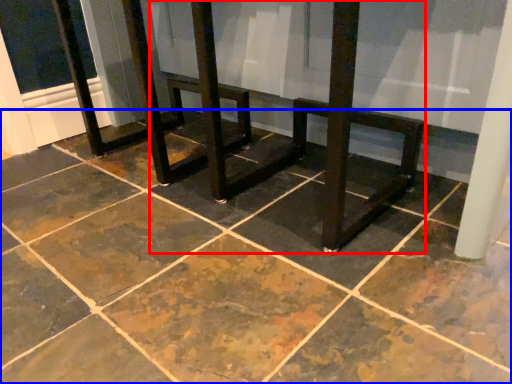
Question: Which of the following is the closest to the observer, round table (highlighted by a red box) or concrete (highlighted by a blue box)?

Choices:
 (A) round table
 (B) concrete

Answer: (B)